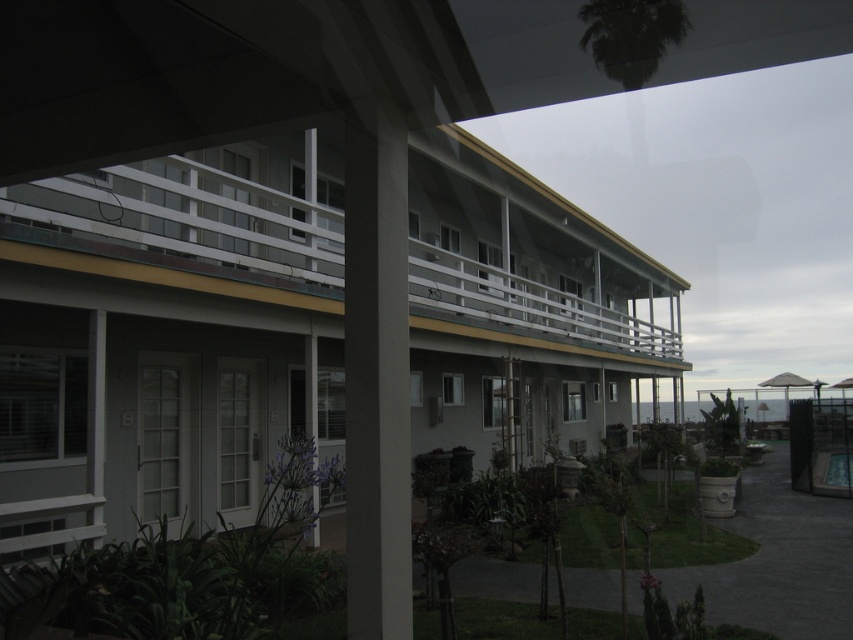
You are standing at the entrance of the building and want to take a photo of the white painted wood balcony at upper center. If your camera can focus on objects up to 4 meters away, will it be able to capture the balcony clearly?

The white painted wood balcony at upper center is 3.71 meters away from the camera, which is within the camera focus range of 4 meters. Therefore, the camera can capture the balcony clearly.

You are standing at the entrance of the covered walkway and want to reach the white matte building at center. There is a gray concrete pillar at center in your path. Considering the distance between them, can you walk straight towards the building without going around the pillar?

The white matte building at center is 46.58 feet away from the gray concrete pillar at center. Since the distance is quite large, you can walk straight towards the building without needing to go around the pillar.